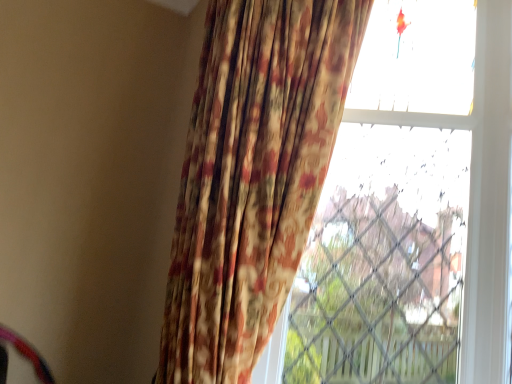
Question: Considering the positions of transparent glass window at upper right and floral fabric curtain at center in the image, is transparent glass window at upper right taller or shorter than floral fabric curtain at center?

Choices:
 (A) short
 (B) tall

Answer: (B)

Question: Is point (503, 62) positioned closer to the camera than point (172, 271)?

Choices:
 (A) farther
 (B) closer

Answer: (B)

Question: Considering the relative positions of transparent glass window at upper right and floral fabric curtain at center in the image provided, is transparent glass window at upper right to the left or to the right of floral fabric curtain at center?

Choices:
 (A) right
 (B) left

Answer: (A)

Question: Is point (205, 168) positioned closer to the camera than point (474, 203)?

Choices:
 (A) farther
 (B) closer

Answer: (B)

Question: Is floral fabric curtain at center wider or thinner than transparent glass window at upper right?

Choices:
 (A) thin
 (B) wide

Answer: (B)

Question: Is floral fabric curtain at center inside the boundaries of transparent glass window at upper right, or outside?

Choices:
 (A) inside
 (B) outside

Answer: (B)

Question: From the image's perspective, is floral fabric curtain at center above or below transparent glass window at upper right?

Choices:
 (A) above
 (B) below

Answer: (A)